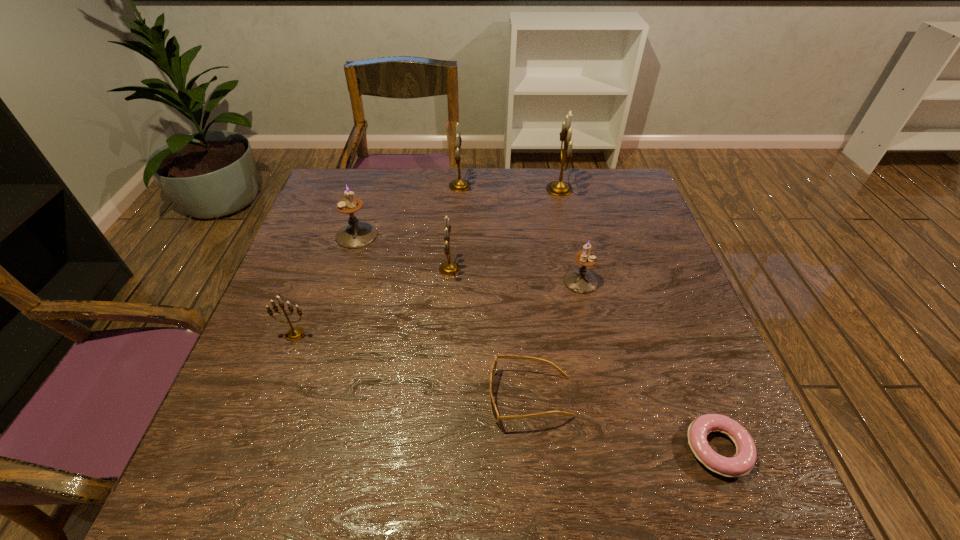
Locate an element on the screen. Image resolution: width=960 pixels, height=540 pixels. the smallest gold candelabrum is located at coordinates (294, 333).

This screenshot has width=960, height=540. I want to click on the fifth object from left to right, so click(x=496, y=416).

At what (x,y) coordinates should I click in order to perform the action: click on the second shortest object. Please return your answer as a coordinate pair (x, y). The image size is (960, 540). Looking at the image, I should click on (496, 416).

Find the location of `pink doughnut`. pink doughnut is located at coordinates (743, 461).

The height and width of the screenshot is (540, 960). In order to click on the rightmost object in this screenshot , I will do `click(743, 461)`.

Locate an element on the screen. The image size is (960, 540). vacant region located 0.390m on the left of the tallest object is located at coordinates (420, 189).

You are a GUI agent. You are given a task and a screenshot of the screen. Output one action in this format:
    pyautogui.click(x=<x>, y=<y>)
    Task: Click on the vacant space located 0.180m on the right of the second tallest candelabrum
    The image size is (960, 540).
    Given the screenshot: What is the action you would take?
    pyautogui.click(x=528, y=186)

Locate an element on the screen. free space located on the back of the farther purple candle holder is located at coordinates (369, 196).

This screenshot has width=960, height=540. I want to click on vacant region located on the right of the second nearest gold candelabrum, so click(532, 269).

The image size is (960, 540). Find the location of `free space located on the back of the smaller purple candle holder`. free space located on the back of the smaller purple candle holder is located at coordinates (564, 206).